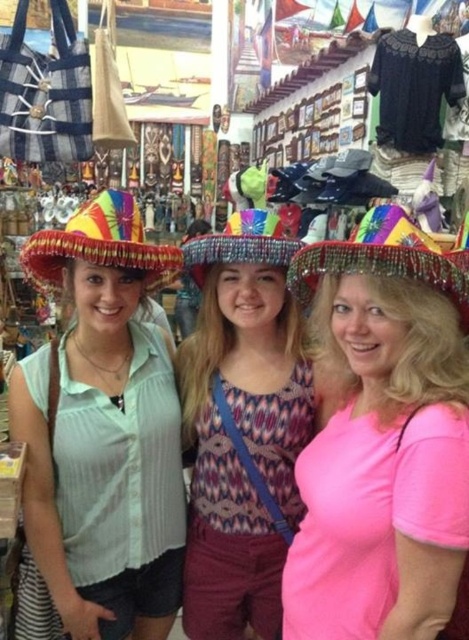
You are a tourist in the market and want to buy the shiny metallic sombrero at center and the rainbow beaded sombrero at center. However, you can only reach items that are in front of others. Can you reach both sombreros?

The shiny metallic sombrero at center is in front of the rainbow beaded sombrero at center, so you can reach the shiny metallic sombrero at center. However, the rainbow beaded sombrero at center is behind the shiny metallic sombrero at center, so you cannot reach it.

You are a customer in the market and want to buy the shiny metallic sombrero at center. The vendor says it is located at coordinates point 0.684, 0.814. If you are standing at the origin point 0,0 at the entrance, which direction should you move to reach it?

The shiny metallic sombrero at center is located at point [381,436], which means you should move towards the upper right direction from the entrance at [0,0] to reach it.

You are standing at the point marked by coordinates point (430, 241) in a market. You want to greet a friend who is exactly 2 meters away from you. Can you reach your friend by taking one step forward?

The distance between point (430, 241) and the viewer is 1.88 meters. Since your friend is 2 meters away, you are currently 0.12 meters short. Taking one step forward might help you cover the remaining distance, but it depends on your step length. If your step is at least 0.12 meters, you can reach them.